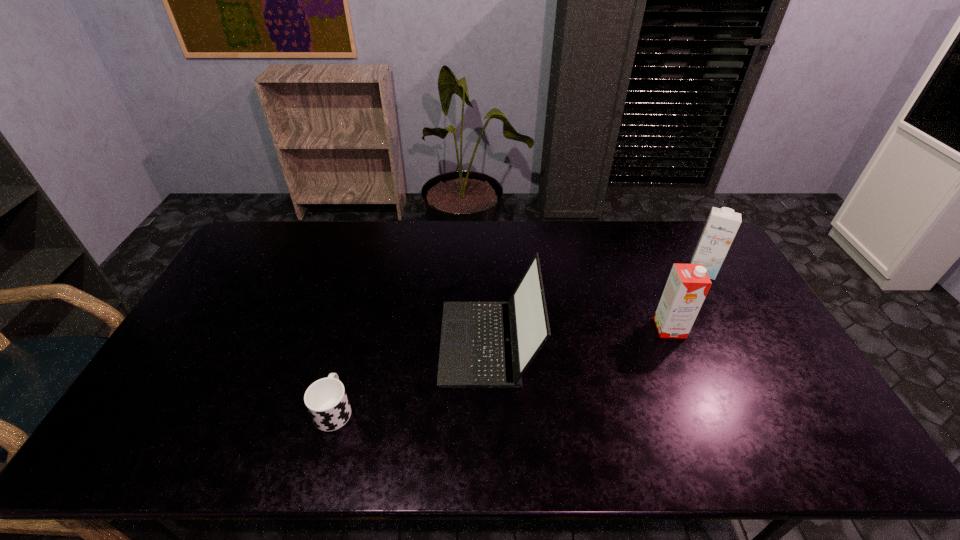
Find the location of a particular element. The width and height of the screenshot is (960, 540). free region located 0.310m on the surface of the second object from left to right is located at coordinates (334, 342).

Locate an element on the screen. vacant space located 0.260m on the surface of the second object from left to right is located at coordinates (351, 342).

Identify the location of vacant space located on the side of the leftmost object with the handle. The height and width of the screenshot is (540, 960). (352, 344).

Where is `free location located on the side of the leftmost object with the handle`? The image size is (960, 540). free location located on the side of the leftmost object with the handle is located at coordinates (358, 321).

Locate an element on the screen. The height and width of the screenshot is (540, 960). blank area located on the side of the leftmost object with the handle is located at coordinates tap(356, 331).

Where is `object located at the far edge`? This screenshot has height=540, width=960. object located at the far edge is located at coordinates (722, 224).

At what (x,y) coordinates should I click in order to perform the action: click on object present at the near edge. Please return your answer as a coordinate pair (x, y). Looking at the image, I should click on (326, 400).

The width and height of the screenshot is (960, 540). I want to click on object that is at the right edge, so click(722, 224).

Locate an element on the screen. object that is at the far right corner is located at coordinates (722, 224).

I want to click on vacant space at the far edge of the desktop, so click(x=582, y=221).